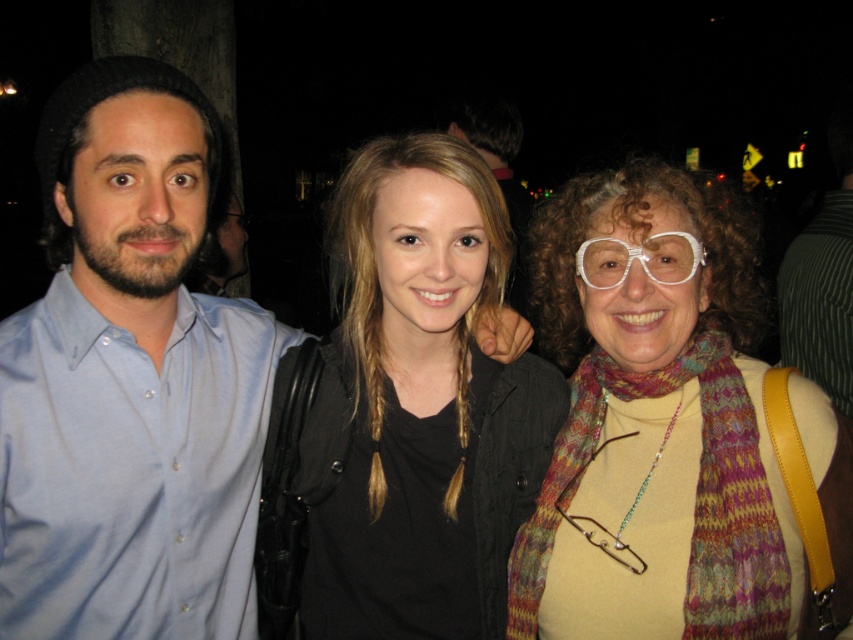
Which is above, matte blue shirt at left or white plastic glasses at center?

matte blue shirt at left

Which is more to the right, matte blue shirt at left or white plastic glasses at center?

Positioned to the right is white plastic glasses at center.

Does point (527, 273) lie behind point (683, 262)?

Yes, it is.

Where is `matte blue shirt at left`? matte blue shirt at left is located at coordinates (498, 172).

Is black matte jacket at center above white plastic glasses at center?

No.

Can you confirm if black matte jacket at center is positioned below white plastic glasses at center?

Correct, black matte jacket at center is located below white plastic glasses at center.

The height and width of the screenshot is (640, 853). I want to click on black matte jacket at center, so click(x=418, y=406).

Does light blue shirt at left appear on the left side of black matte jacket at center?

Yes, light blue shirt at left is to the left of black matte jacket at center.

Does light blue shirt at left lie behind black matte jacket at center?

No, light blue shirt at left is closer to the viewer.

This screenshot has width=853, height=640. What do you see at coordinates (131, 381) in the screenshot?
I see `light blue shirt at left` at bounding box center [131, 381].

Where is `light blue shirt at left`? light blue shirt at left is located at coordinates (131, 381).